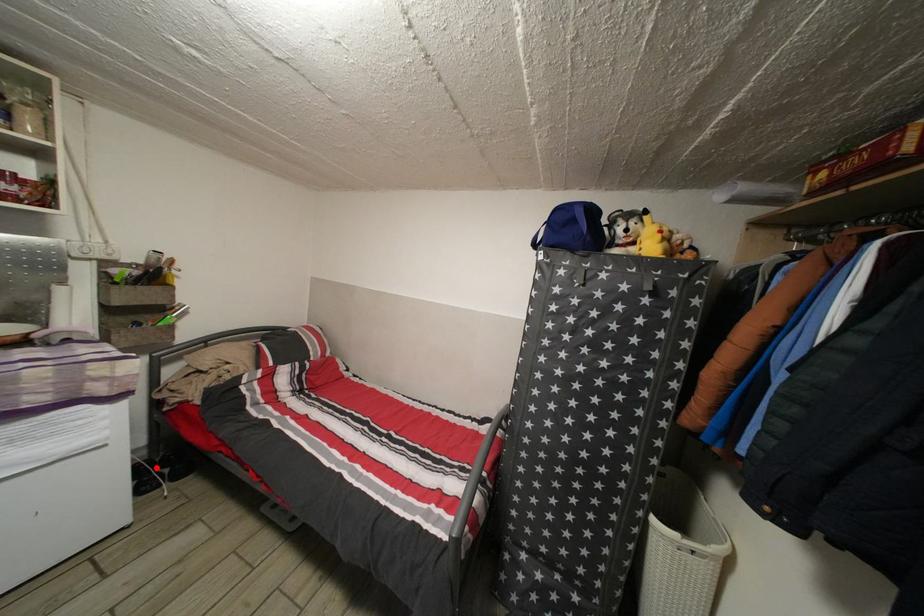
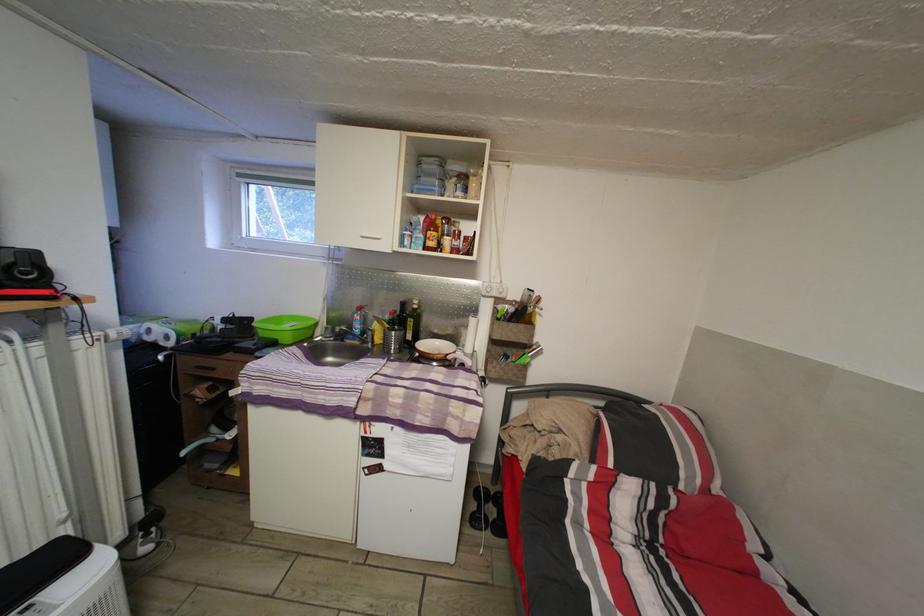
Locate, in the second image, the point that corresponds to the highlighted location in the first image.

(493, 498)